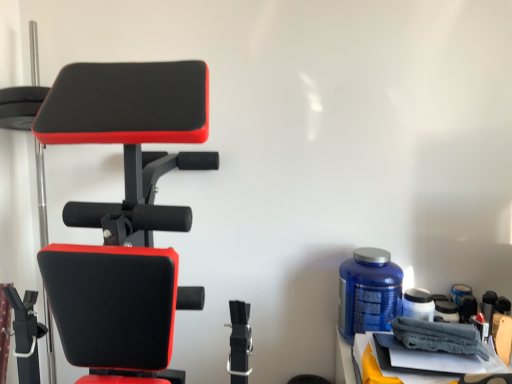
Question: Would you say matte black exercise bench at left is to the left or to the right of gray fabric towel at lower right in the picture?

Choices:
 (A) right
 (B) left

Answer: (B)

Question: Is matte black exercise bench at left bigger or smaller than gray fabric towel at lower right?

Choices:
 (A) small
 (B) big

Answer: (B)

Question: Based on their relative distances, which object is nearer to the gray fabric towel at lower right?

Choices:
 (A) blue plastic bottle at right
 (B) matte black exercise bench at left

Answer: (A)

Question: Estimate the real-world distances between objects in this image. Which object is closer to the gray fabric towel at lower right?

Choices:
 (A) matte black exercise bench at left
 (B) blue plastic bottle at right

Answer: (B)